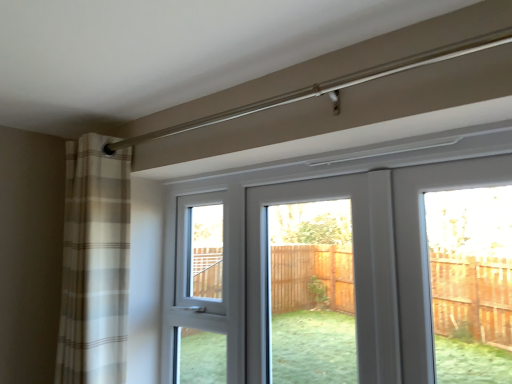
Question: Is white glossy door at center further to camera compared to plaid fabric curtain at left?

Choices:
 (A) no
 (B) yes

Answer: (A)

Question: From the image's perspective, is white glossy door at center over plaid fabric curtain at left?

Choices:
 (A) yes
 (B) no

Answer: (B)

Question: Is white glossy door at center closer to camera compared to plaid fabric curtain at left?

Choices:
 (A) no
 (B) yes

Answer: (B)

Question: Is white glossy door at center positioned with its back to plaid fabric curtain at left?

Choices:
 (A) no
 (B) yes

Answer: (A)

Question: Does white glossy door at center have a lesser width compared to plaid fabric curtain at left?

Choices:
 (A) yes
 (B) no

Answer: (A)

Question: From a real-world perspective, is white glossy door at center physically located above or below plaid fabric curtain at left?

Choices:
 (A) above
 (B) below

Answer: (B)

Question: Relative to plaid fabric curtain at left, is white glossy door at center in front or behind?

Choices:
 (A) behind
 (B) front

Answer: (B)

Question: In terms of width, does white glossy door at center look wider or thinner when compared to plaid fabric curtain at left?

Choices:
 (A) wide
 (B) thin

Answer: (B)

Question: Looking at the image, does white glossy door at center seem bigger or smaller compared to plaid fabric curtain at left?

Choices:
 (A) small
 (B) big

Answer: (A)

Question: Looking at their shapes, would you say white plastic screen door at center is wider or thinner than white glossy door at center?

Choices:
 (A) thin
 (B) wide

Answer: (B)

Question: Looking at the image, does white plastic screen door at center seem bigger or smaller compared to white glossy door at center?

Choices:
 (A) small
 (B) big

Answer: (A)

Question: From their relative heights in the image, would you say white plastic screen door at center is taller or shorter than white glossy door at center?

Choices:
 (A) short
 (B) tall

Answer: (B)

Question: Is point (264, 379) closer or farther from the camera than point (284, 208)?

Choices:
 (A) farther
 (B) closer

Answer: (B)

Question: Is point (303, 263) positioned closer to the camera than point (262, 380)?

Choices:
 (A) farther
 (B) closer

Answer: (A)

Question: Considering the positions of white glossy door at center and white plastic screen door at center in the image, is white glossy door at center bigger or smaller than white plastic screen door at center?

Choices:
 (A) big
 (B) small

Answer: (A)